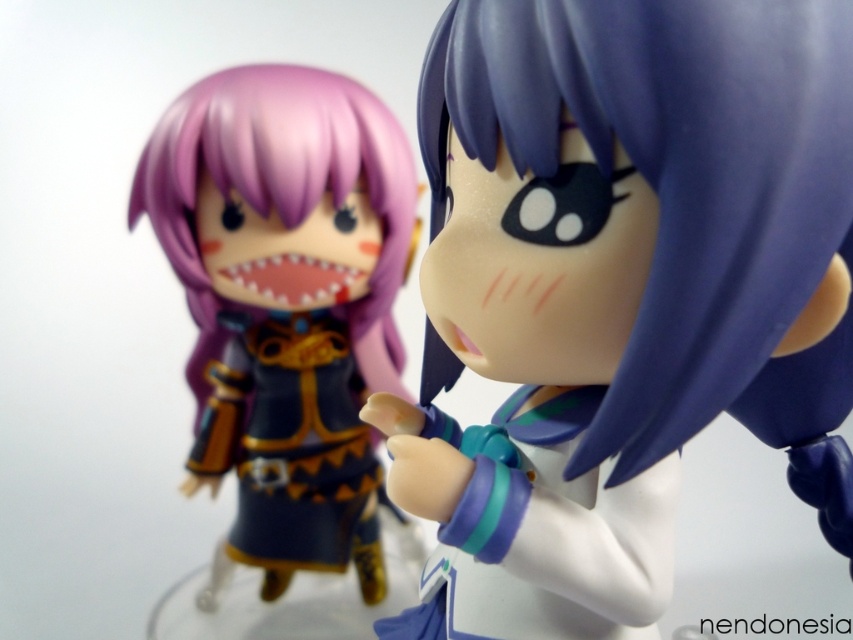
Question: Among these points, which one is farthest from the camera?

Choices:
 (A) (641, 211)
 (B) (344, 410)

Answer: (B)

Question: Is satin purple hair at center wider than matte purple hair at left?

Choices:
 (A) no
 (B) yes

Answer: (B)

Question: Which of the following is the farthest from the observer?

Choices:
 (A) satin purple hair at center
 (B) matte purple hair at left

Answer: (B)

Question: Is satin purple hair at center above matte purple hair at left?

Choices:
 (A) yes
 (B) no

Answer: (A)

Question: Does satin purple hair at center have a larger size compared to matte purple hair at left?

Choices:
 (A) no
 (B) yes

Answer: (A)

Question: Which object appears farthest from the camera in this image?

Choices:
 (A) matte purple hair at left
 (B) satin purple hair at center

Answer: (A)